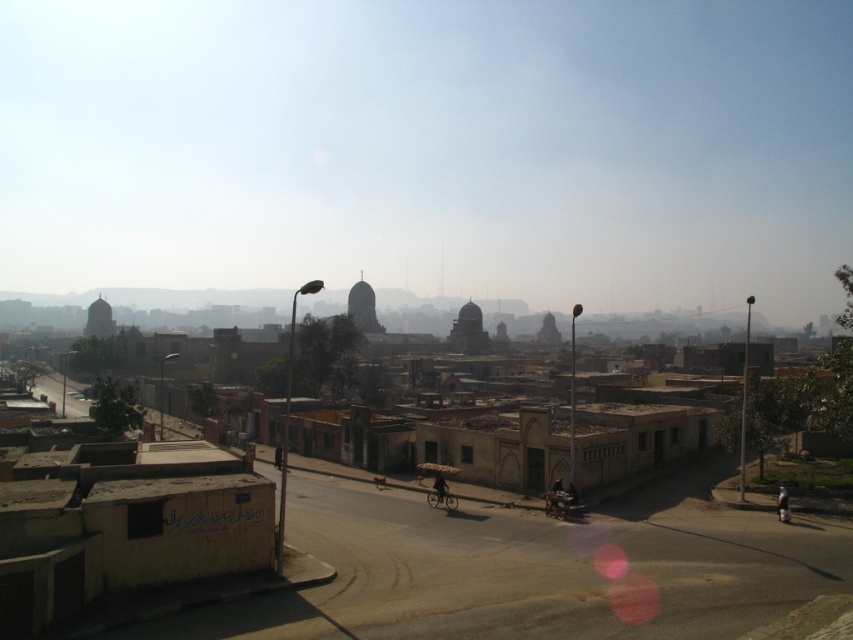
Question: Among these points, which one is farthest from the camera?

Choices:
 (A) (439, 492)
 (B) (782, 492)

Answer: (A)

Question: Is light brown fabric bag at lower right positioned behind dark blue fabric bicycle at center?

Choices:
 (A) yes
 (B) no

Answer: (B)

Question: Is dark blue fabric bicycle at center in front of dark brown leather bag at center?

Choices:
 (A) no
 (B) yes

Answer: (B)

Question: Can you confirm if light brown fabric bag at lower right is positioned to the left of dark brown leather bag at center?

Choices:
 (A) no
 (B) yes

Answer: (A)

Question: Which object appears farthest from the camera in this image?

Choices:
 (A) dark brown leather bag at center
 (B) dark blue fabric bicycle at center

Answer: (A)

Question: Which object appears farthest from the camera in this image?

Choices:
 (A) dark brown leather bag at center
 (B) dark blue fabric bicycle at center

Answer: (A)